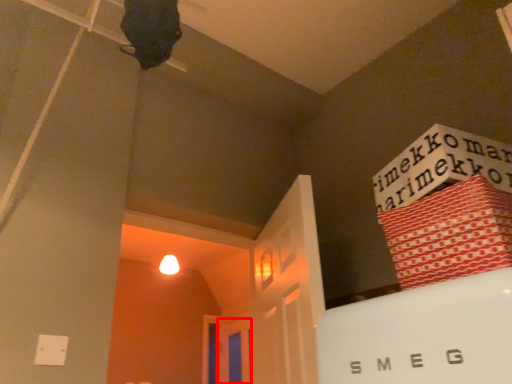
Question: From the image's perspective, what is the correct spatial positioning of door (annotated by the red box) in reference to bundle?

Choices:
 (A) below
 (B) above

Answer: (A)